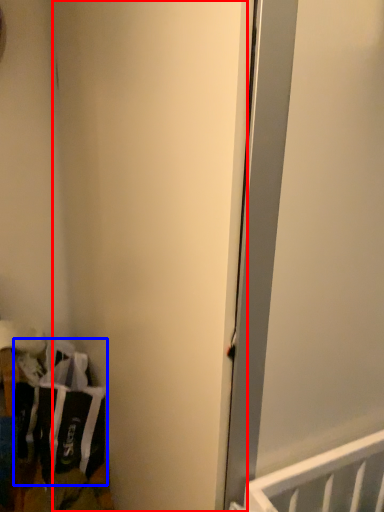
Question: Which object is closer to the camera taking this photo, door (highlighted by a red box) or laundry (highlighted by a blue box)?

Choices:
 (A) door
 (B) laundry

Answer: (A)